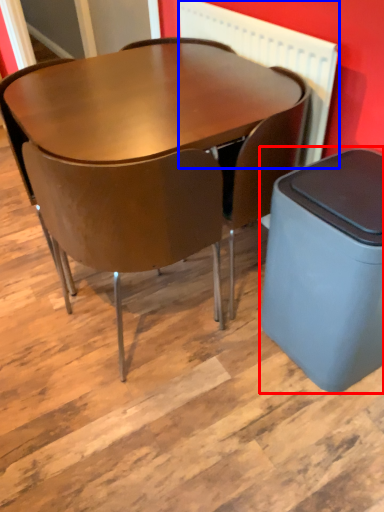
Question: Among these objects, which one is farthest to the camera, waste container (highlighted by a red box) or radiator (highlighted by a blue box)?

Choices:
 (A) waste container
 (B) radiator

Answer: (B)